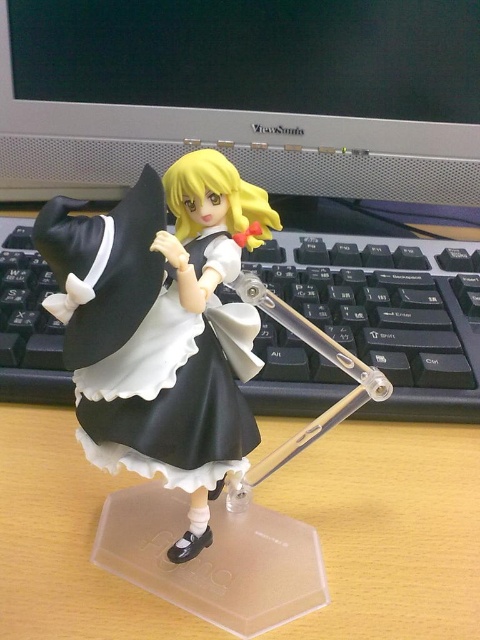
Question: Among these objects, which one is nearest to the camera?

Choices:
 (A) satin silver monitor at upper center
 (B) black satin dress at center

Answer: (B)

Question: Considering the relative positions of black matte maid outfit at center and black satin dress at center in the image provided, where is black matte maid outfit at center located with respect to black satin dress at center?

Choices:
 (A) left
 (B) right

Answer: (B)

Question: Which is nearer to the black satin dress at center?

Choices:
 (A) satin silver monitor at upper center
 (B) black matte maid outfit at center

Answer: (B)

Question: Which object is the farthest from the black matte maid outfit at center?

Choices:
 (A) satin silver monitor at upper center
 (B) black satin dress at center

Answer: (A)

Question: Observing the image, what is the correct spatial positioning of black matte maid outfit at center in reference to satin silver monitor at upper center?

Choices:
 (A) above
 (B) below

Answer: (B)

Question: Does black matte maid outfit at center have a smaller size compared to black satin dress at center?

Choices:
 (A) no
 (B) yes

Answer: (A)